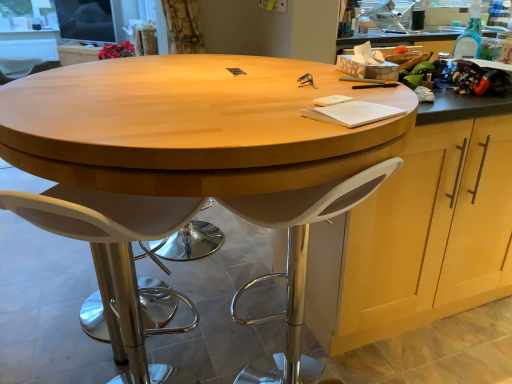
The image size is (512, 384). Find the location of `free point behind white plastic stool at lower left, which is the 1th chair in front-to-back order`. free point behind white plastic stool at lower left, which is the 1th chair in front-to-back order is located at coordinates (167, 339).